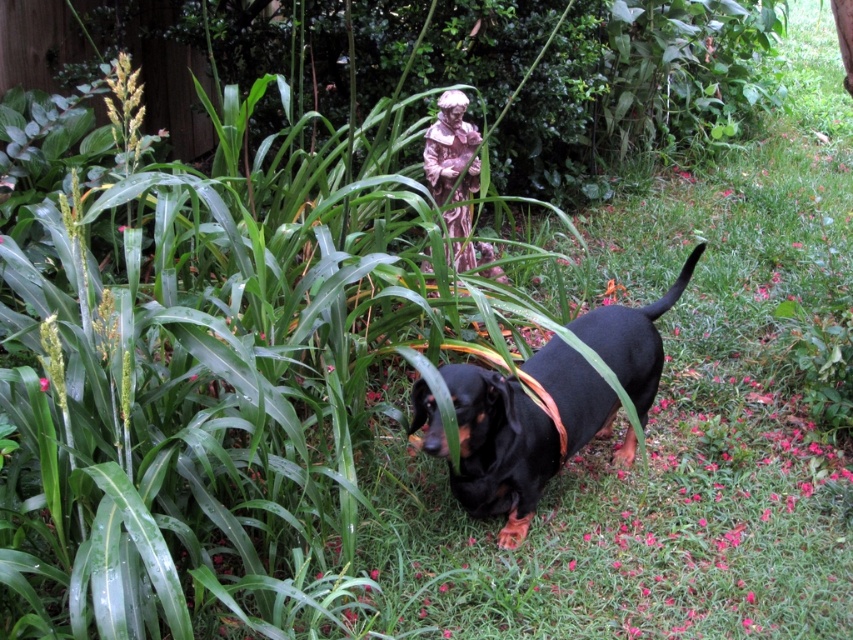
You are a photographer setting up a tripod in this garden. You need to position the camera so that both the black matte dog at center and the pink ceramic statue at upper center are in the frame. Given their sizes, which object should you ensure is closer to the camera to maintain balance in the composition?

The black matte dog at center is larger than the pink ceramic statue at upper center. To balance the composition, the smaller pink ceramic statue at upper center should be placed closer to the camera while the larger black matte dog at center can be positioned farther back.

You are a photographer standing at the camera position. You want to take a photo of the black matte dog at center. If you need to adjust your position to be exactly 10 feet away from the dog, should you move closer or farther away?

The black matte dog at center is currently 9.29 feet away from the camera. To reach exactly 10 feet, you should move slightly farther away from the dog.